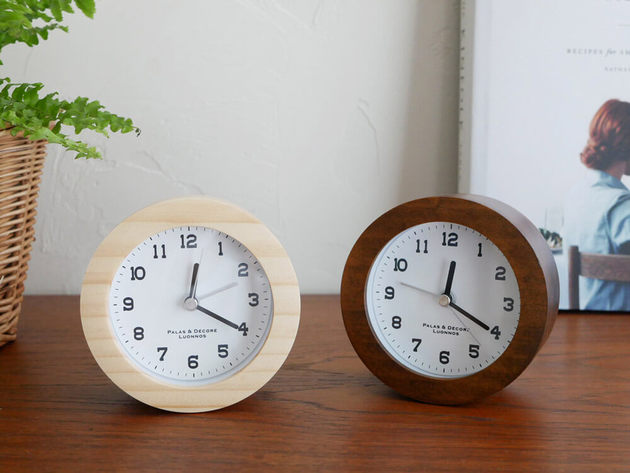
I want to click on hour hands on clock, so click(x=193, y=272), click(x=450, y=266).